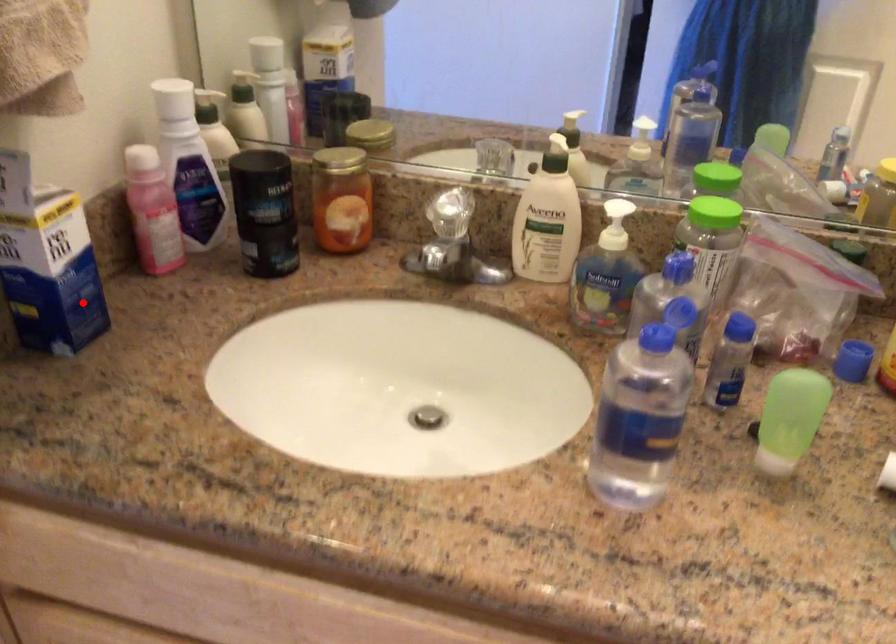
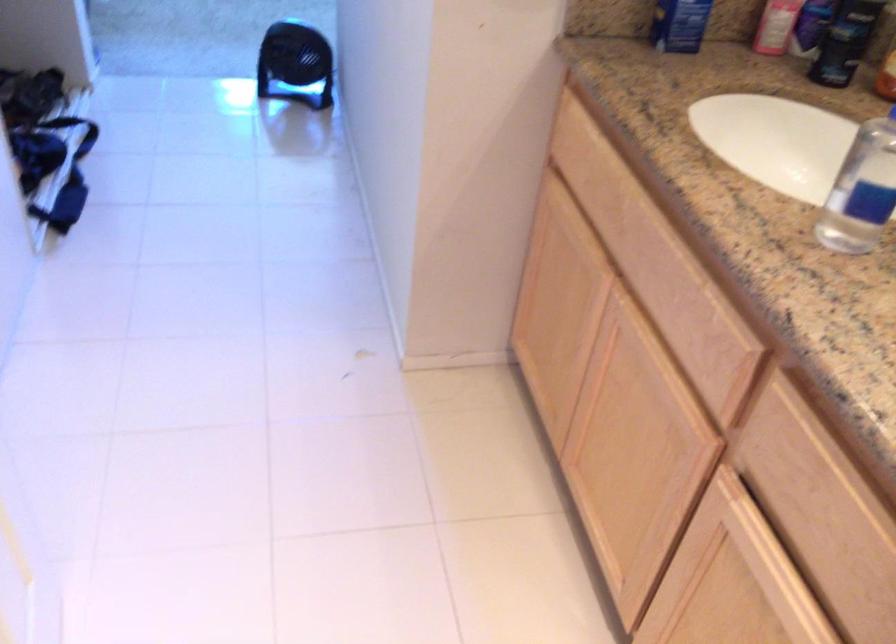
Question: A red point is marked in image1. In image2, is the corresponding 3D point closer to the camera or farther? Reply with the corresponding letter.

Choices:
 (A) The corresponding 3D point is closer.
 (B) The corresponding 3D point is farther.

Answer: (B)